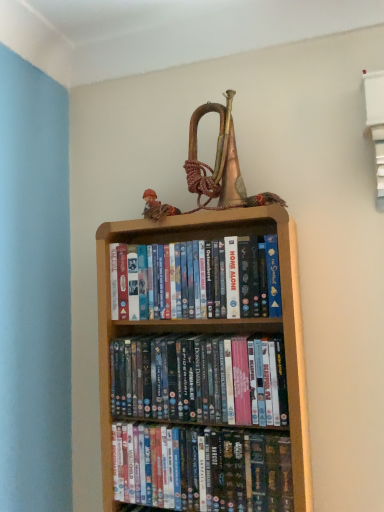
Question: Is wooden bookcase at center at the right side of matte plastic dvds at center, the first book viewed from the top?

Choices:
 (A) no
 (B) yes

Answer: (B)

Question: Does wooden bookcase at center have a greater height compared to matte plastic dvds at center, the first book viewed from the top?

Choices:
 (A) no
 (B) yes

Answer: (B)

Question: Is wooden bookcase at center aimed at matte plastic dvds at center, the first book viewed from the top?

Choices:
 (A) yes
 (B) no

Answer: (A)

Question: Is wooden bookcase at center not within matte plastic dvds at center, acting as the 3th book starting from the bottom?

Choices:
 (A) yes
 (B) no

Answer: (A)

Question: From the image's perspective, is wooden bookcase at center beneath matte plastic dvds at center, the first book viewed from the top?

Choices:
 (A) yes
 (B) no

Answer: (A)

Question: Is shiny plastic dvds at center, arranged as the first book when ordered from the bottom, taller or shorter than matte brown doll at upper center?

Choices:
 (A) short
 (B) tall

Answer: (B)

Question: Do you think shiny plastic dvds at center, arranged as the first book when ordered from the bottom, is within matte brown doll at upper center, or outside of it?

Choices:
 (A) outside
 (B) inside

Answer: (A)

Question: Based on their positions, is shiny plastic dvds at center, which is the third book from top to bottom, located to the left or right of matte brown doll at upper center?

Choices:
 (A) left
 (B) right

Answer: (B)

Question: From a real-world perspective, relative to matte brown doll at upper center, is shiny plastic dvds at center, arranged as the first book when ordered from the bottom, vertically above or below?

Choices:
 (A) above
 (B) below

Answer: (B)

Question: Is matte plastic dvds at center, marked as the 2th book in a top-to-bottom arrangement, wider or thinner than matte plastic dvds at center, acting as the 3th book starting from the bottom?

Choices:
 (A) thin
 (B) wide

Answer: (A)

Question: Is point (235, 362) positioned closer to the camera than point (244, 267)?

Choices:
 (A) closer
 (B) farther

Answer: (A)

Question: In the image, is matte plastic dvds at center, positioned as the 2th book in bottom-to-top order, on the left side or the right side of matte plastic dvds at center, the first book viewed from the top?

Choices:
 (A) left
 (B) right

Answer: (B)

Question: Is matte plastic dvds at center, marked as the 2th book in a top-to-bottom arrangement, taller or shorter than matte plastic dvds at center, acting as the 3th book starting from the bottom?

Choices:
 (A) tall
 (B) short

Answer: (B)

Question: Is wooden bookcase at center taller or shorter than matte plastic dvds at center, marked as the 2th book in a top-to-bottom arrangement?

Choices:
 (A) short
 (B) tall

Answer: (B)

Question: Would you say wooden bookcase at center is to the left or to the right of matte plastic dvds at center, marked as the 2th book in a top-to-bottom arrangement, in the picture?

Choices:
 (A) left
 (B) right

Answer: (A)